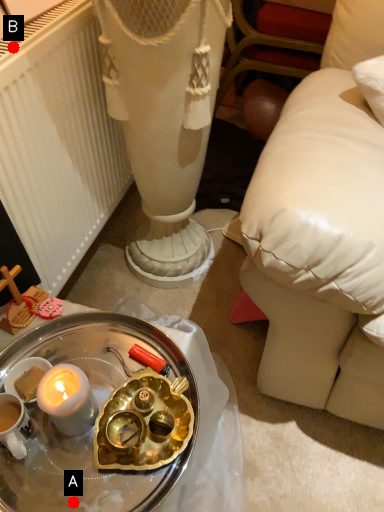
Question: Two points are circled on the image, labeled by A and B beside each circle. Among these points, which one is farthest from the camera?

Choices:
 (A) A is further
 (B) B is further

Answer: (B)